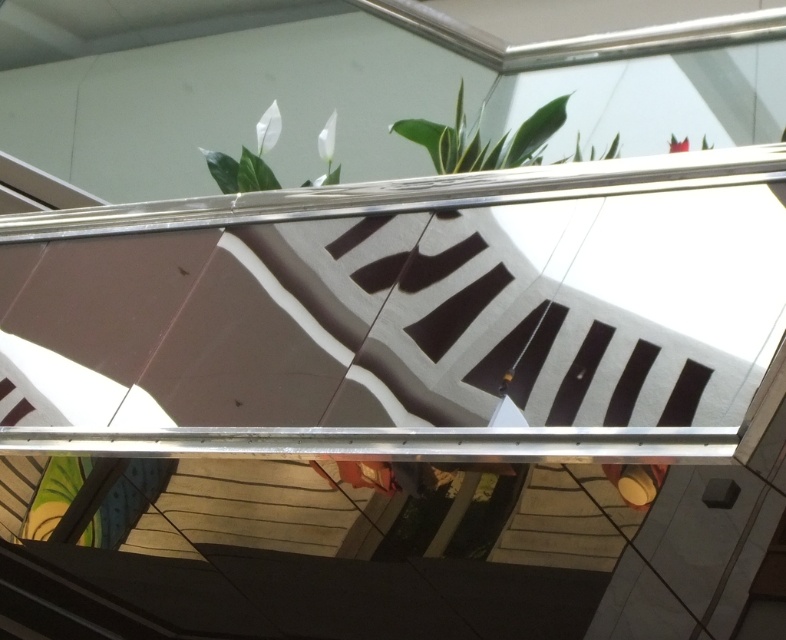
Question: Which point is farther to the camera?

Choices:
 (A) (250, 168)
 (B) (468, 150)

Answer: (A)

Question: Which point appears closest to the camera in this image?

Choices:
 (A) (450, 168)
 (B) (267, 188)

Answer: (A)

Question: Does green leafy plant at upper center have a greater width compared to white matte leaf at upper center?

Choices:
 (A) yes
 (B) no

Answer: (A)

Question: Can you confirm if green leafy plant at upper center is thinner than white matte leaf at upper center?

Choices:
 (A) no
 (B) yes

Answer: (A)

Question: Does green leafy plant at upper center appear on the right side of white matte leaf at upper center?

Choices:
 (A) yes
 (B) no

Answer: (A)